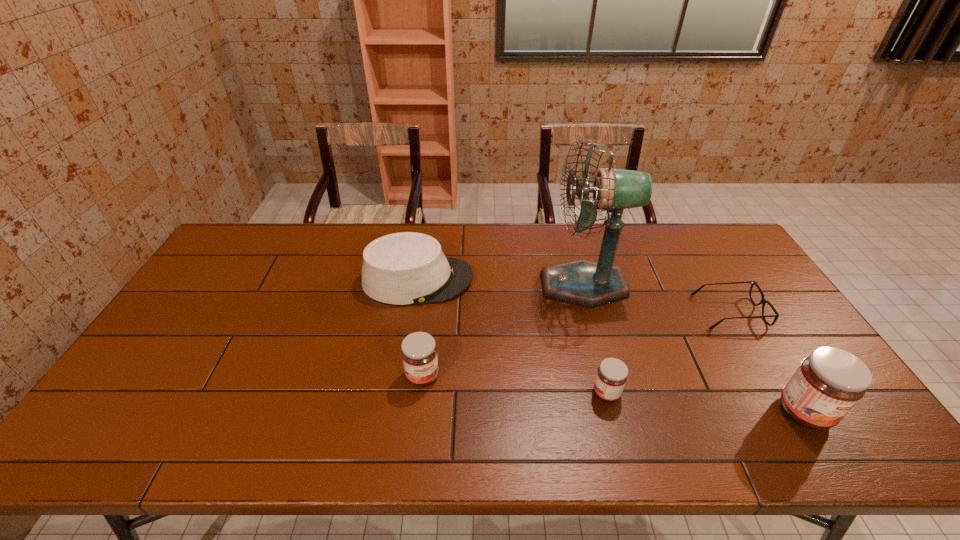
Image resolution: width=960 pixels, height=540 pixels. In order to click on vacant space located 0.170m on the left of the fifth shortest object in this screenshot , I will do `click(708, 412)`.

Locate an element on the screen. vacant position located 0.370m in front of the tallest object where the wind blows is located at coordinates (425, 286).

You are a GUI agent. You are given a task and a screenshot of the screen. Output one action in this format:
    pyautogui.click(x=<x>, y=<y>)
    Task: Click on the blank area located 0.180m in front of the tallest object where the wind blows
    
    Given the screenshot: What is the action you would take?
    pyautogui.click(x=485, y=286)

The height and width of the screenshot is (540, 960). I want to click on blank space located 0.300m in front of the tallest object where the wind blows, so click(447, 286).

Identify the location of vacant space located 0.320m on the front-facing side of the hat. The height and width of the screenshot is (540, 960). (572, 280).

Locate an element on the screen. This screenshot has height=540, width=960. vacant space situated with the lenses facing outward on the shortest object is located at coordinates (649, 312).

Locate an element on the screen. The height and width of the screenshot is (540, 960). vacant space located with the lenses facing outward on the shortest object is located at coordinates (586, 312).

In order to click on free point located with the lenses facing outward on the shortest object in this screenshot , I will do `click(662, 312)`.

Image resolution: width=960 pixels, height=540 pixels. Find the location of `fan that is at the far edge`. fan that is at the far edge is located at coordinates (581, 282).

This screenshot has height=540, width=960. I want to click on hat that is positioned at the far edge, so click(x=404, y=268).